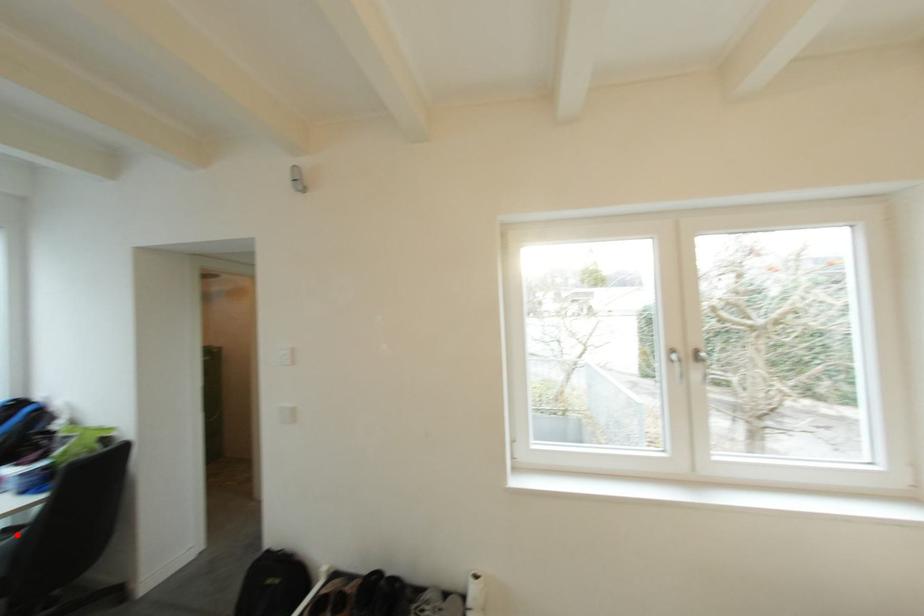
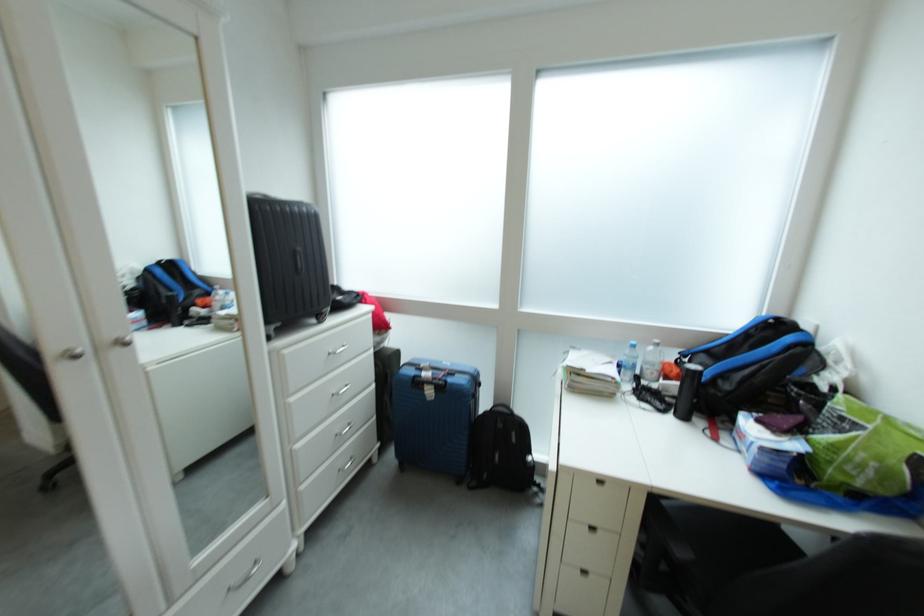
Question: I am providing you with two images of the same scene from different viewpoints. A red point is marked on the first image. Can you still see the location of the red point in image 2?

Choices:
 (A) Yes
 (B) No

Answer: (B)